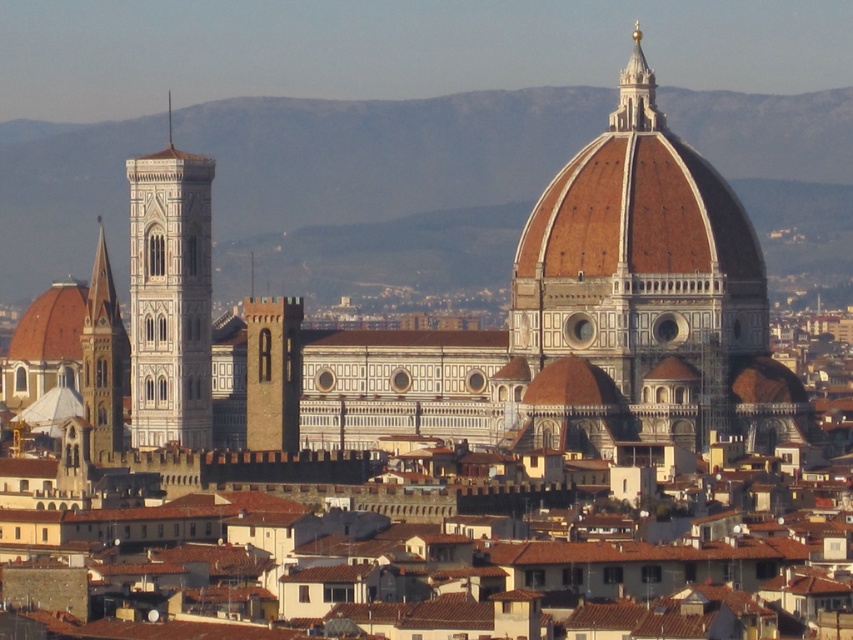
You are an architect visiting Florence and want to compare the sizes of the white stone tower at left and the gold metallic spire at upper center in the image. Based on the scene, which one appears bigger?

The white stone tower at left is larger in size than the gold metallic spire at upper center, so the white stone tower at left appears bigger.

Looking at the Florence skyline, you see the white stone tower at left and the gold metallic spire at upper center. Which one is positioned to the left of the other?

The white stone tower at left is positioned to the left of the gold metallic spire at upper center.

You are a tourist in Florence and want to take a photo of both the white marble dome at center and the golden stone tower at left. Which one should you stand closer to in order to include both in your camera frame?

Since the white marble dome at center is much taller than the golden stone tower at left, you should stand closer to the golden stone tower at left to balance their sizes in the photo.